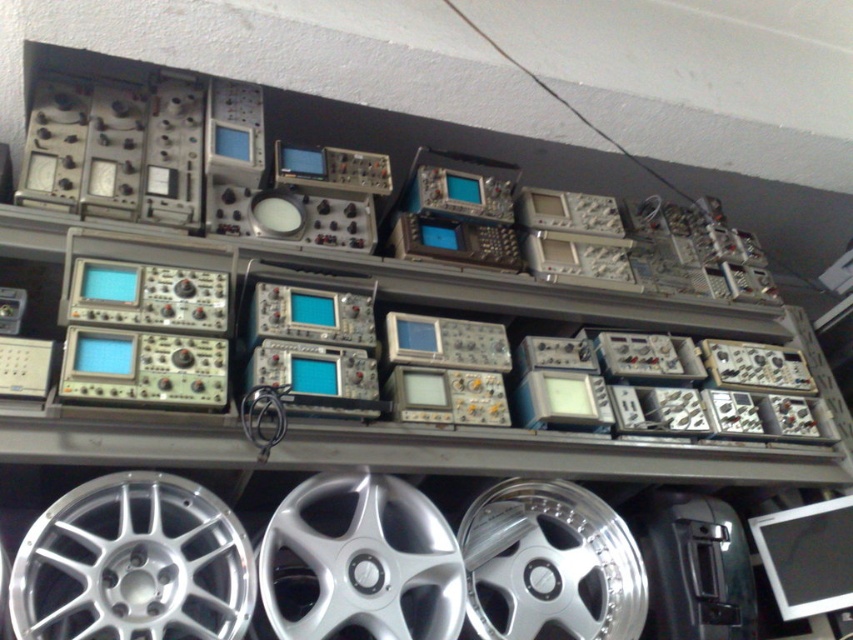
You are standing in front of the electronic test equipment and want to reach both points. Which point, point [233,609] or point [583,636], is closer to you?

Point [233,609] is closer to the camera than point [583,636], so it is closer to you.

You are an engineer who needs to select a wheel for a project that requires the tallest possible wheel. Which of the silver metallic wheel at lower left or silver metallic wheel at center should you choose?

The silver metallic wheel at center is taller than the silver metallic wheel at lower left, so you should choose the silver metallic wheel at center for your project.

You are an engineer who needs to place a new device on the shelf. The shelf has a coordinate system where the bottom left corner is the origin. The silver metallic wheel at center is already placed at position 0.877 on the x axis and 0.428 on the y axis. Can you place your device at position 0.9, 0.5 without overlapping?

The silver metallic wheel at center is at position 0.877 on the x axis and 0.428 on the y axis. Placing a device at (426, 576) would be very close but might overlap depending on the device size. Check the device dimensions before placing.